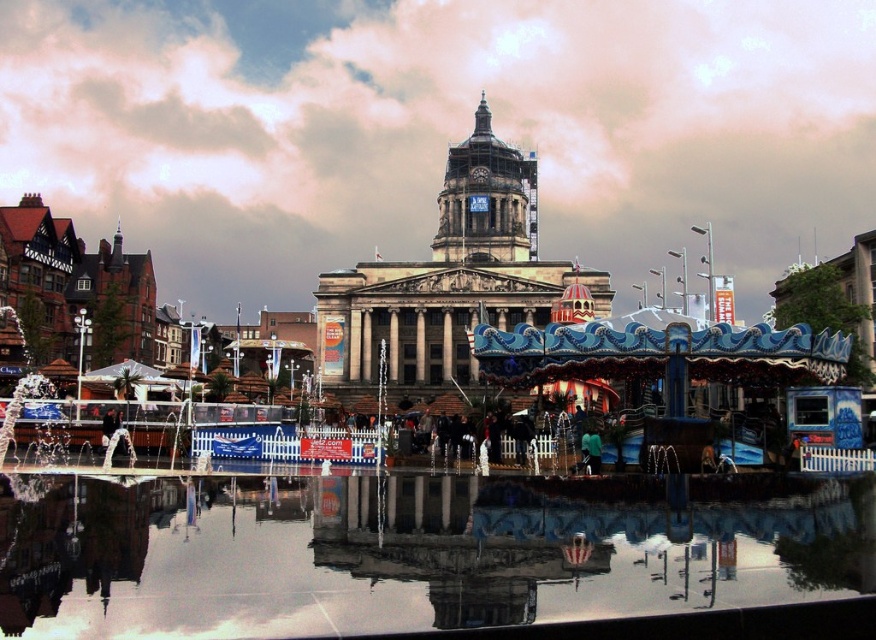
From the picture: Between stone clock tower at center and gray stone clock tower at center, which one appears on the left side from the viewer's perspective?

stone clock tower at center is more to the left.

Is stone clock tower at center wider than gray stone clock tower at center?

Indeed, stone clock tower at center has a greater width compared to gray stone clock tower at center.

Locate an element on the screen. stone clock tower at center is located at coordinates (451, 276).

Is stone clock tower at center taller than blue painted wood carousel at center?

Correct, stone clock tower at center is much taller as blue painted wood carousel at center.

The width and height of the screenshot is (876, 640). What do you see at coordinates (451, 276) in the screenshot? I see `stone clock tower at center` at bounding box center [451, 276].

This screenshot has width=876, height=640. Find the location of `stone clock tower at center`. stone clock tower at center is located at coordinates (451, 276).

Can you confirm if reflective glass water at center is positioned below blue painted wood carousel at center?

Yes.

Is point (230, 550) positioned before point (653, 376)?

Yes, point (230, 550) is in front of point (653, 376).

Between point (273, 516) and point (503, 346), which one is positioned in front?

Point (273, 516)

Identify the location of reflective glass water at center. This screenshot has width=876, height=640. (394, 554).